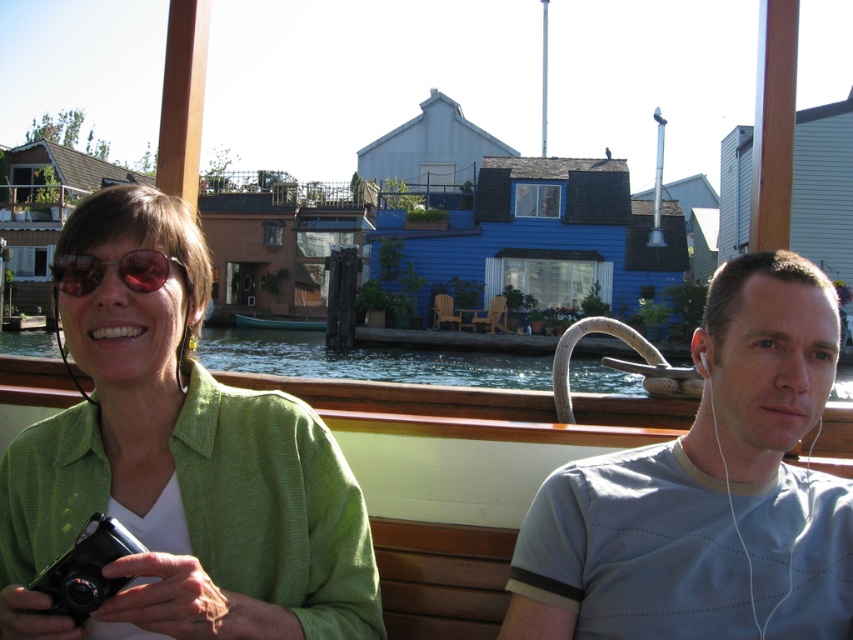
Question: Is clear water at lower center to the left of red reflective sunglasses at center from the viewer's perspective?

Choices:
 (A) yes
 (B) no

Answer: (A)

Question: Based on their relative distances, which object is farther from the clear water at lower center?

Choices:
 (A) red reflective sunglasses at center
 (B) green textured shirt at left

Answer: (A)

Question: Does clear water at lower center come behind black plastic camera at lower left?

Choices:
 (A) no
 (B) yes

Answer: (B)

Question: From the image, what is the correct spatial relationship of green textured shirt at left in relation to clear water at lower center?

Choices:
 (A) right
 (B) left

Answer: (A)

Question: Which point appears farthest from the camera in this image?

Choices:
 (A) (90, 276)
 (B) (57, 602)
 (C) (15, 337)

Answer: (C)

Question: Which is nearer to the clear water at lower center?

Choices:
 (A) gray cotton t-shirt at right
 (B) red reflective sunglasses at center
 (C) teal wooden boat at center
 (D) green textured shirt at left

Answer: (C)